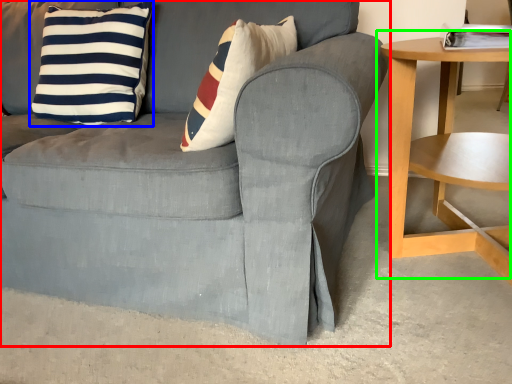
Question: Estimate the real-world distances between objects in this image. Which object is farther from chair (highlighted by a red box), pillow (highlighted by a blue box) or table (highlighted by a green box)?

Choices:
 (A) pillow
 (B) table

Answer: (B)